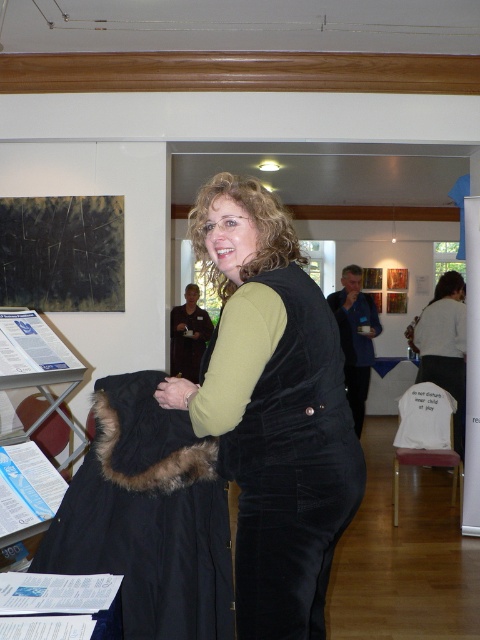
Question: Which object is the farthest from the dark textured canvas at upper left?

Choices:
 (A) white cotton shirt at center
 (B) black furry coat at lower left
 (C) matte black vest at center
 (D) velvet black vest at center

Answer: (C)

Question: From the image, what is the correct spatial relationship of white cotton shirt at center in relation to matte black vest at center?

Choices:
 (A) left
 (B) right

Answer: (B)

Question: Can you confirm if velvet black vest at center is thinner than white cotton shirt at center?

Choices:
 (A) yes
 (B) no

Answer: (B)

Question: Estimate the real-world distances between objects in this image. Which object is closer to the white cotton shirt at center?

Choices:
 (A) dark textured canvas at upper left
 (B) velvet black vest at center

Answer: (A)

Question: Among these objects, which one is nearest to the camera?

Choices:
 (A) dark textured canvas at upper left
 (B) black furry coat at lower left
 (C) white cotton shirt at center
 (D) velvet black vest at center

Answer: (D)

Question: Is velvet black vest at center bigger than black furry coat at lower left?

Choices:
 (A) no
 (B) yes

Answer: (B)